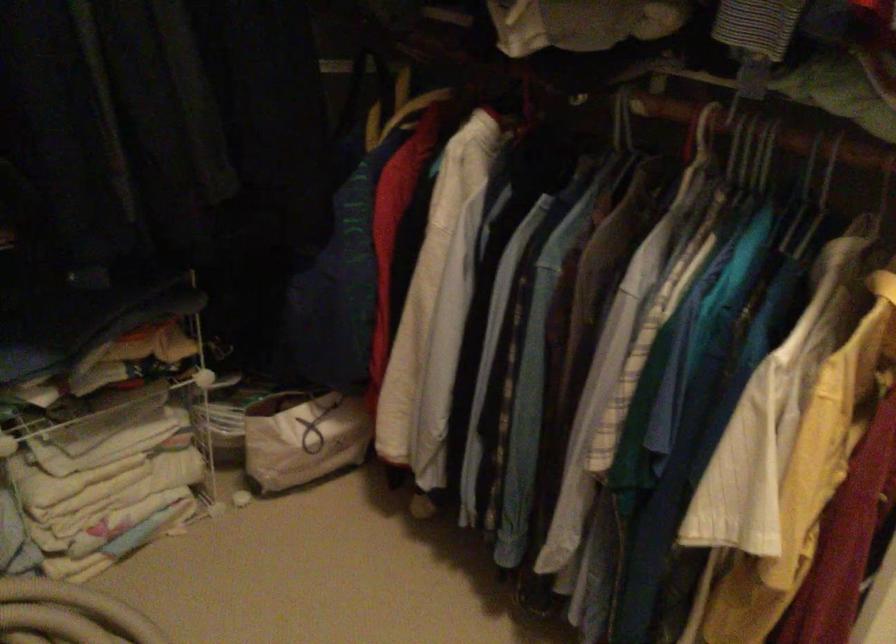
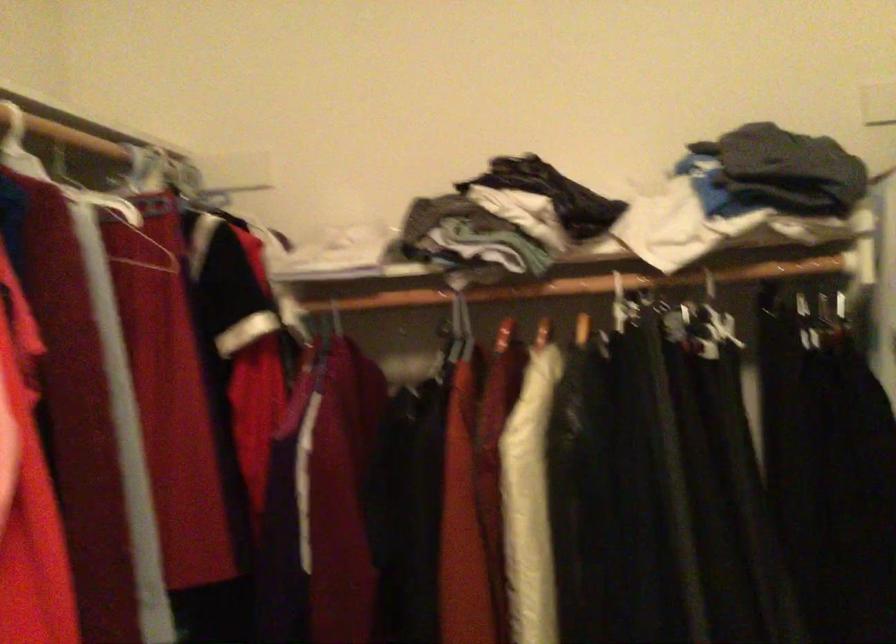
Looking at this image, based on the continuous images, in which direction is the camera rotating?

The rotation direction of the camera is left-up.